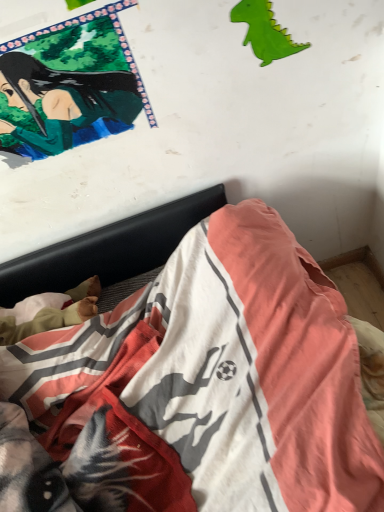
Question: Should I look upward or downward to see cotton bedspread at lower center?

Choices:
 (A) down
 (B) up

Answer: (A)

Question: Does green glossy poster at upper left have a lesser height compared to green paper dinosaur at upper right?

Choices:
 (A) no
 (B) yes

Answer: (A)

Question: Can you confirm if green glossy poster at upper left is smaller than green paper dinosaur at upper right?

Choices:
 (A) no
 (B) yes

Answer: (A)

Question: Can you confirm if green glossy poster at upper left is taller than green paper dinosaur at upper right?

Choices:
 (A) no
 (B) yes

Answer: (B)

Question: Is green glossy poster at upper left not close to green paper dinosaur at upper right?

Choices:
 (A) no
 (B) yes

Answer: (A)

Question: Is green glossy poster at upper left surrounding green paper dinosaur at upper right?

Choices:
 (A) yes
 (B) no

Answer: (B)

Question: Considering the relative positions of green glossy poster at upper left and green paper dinosaur at upper right in the image provided, is green glossy poster at upper left in front of green paper dinosaur at upper right?

Choices:
 (A) no
 (B) yes

Answer: (B)

Question: Does green paper dinosaur at upper right have a smaller size compared to green glossy poster at upper left?

Choices:
 (A) no
 (B) yes

Answer: (B)

Question: Considering the relative sizes of green paper dinosaur at upper right and green glossy poster at upper left in the image provided, is green paper dinosaur at upper right taller than green glossy poster at upper left?

Choices:
 (A) no
 (B) yes

Answer: (A)

Question: Can green glossy poster at upper left be found inside green paper dinosaur at upper right?

Choices:
 (A) yes
 (B) no

Answer: (B)

Question: Is green paper dinosaur at upper right shorter than green glossy poster at upper left?

Choices:
 (A) yes
 (B) no

Answer: (A)

Question: Would you say green paper dinosaur at upper right is outside green glossy poster at upper left?

Choices:
 (A) yes
 (B) no

Answer: (A)

Question: Can you confirm if green paper dinosaur at upper right is bigger than green glossy poster at upper left?

Choices:
 (A) yes
 (B) no

Answer: (B)

Question: From the image's perspective, is green glossy poster at upper left located beneath cotton bedspread at lower center?

Choices:
 (A) yes
 (B) no

Answer: (B)